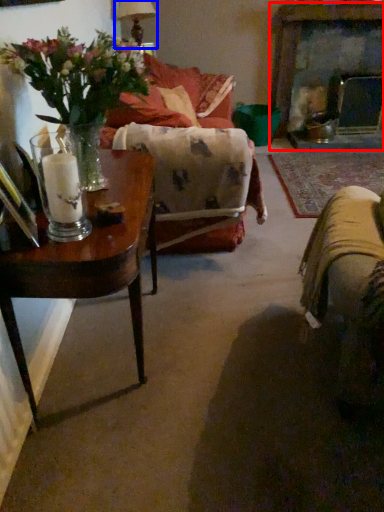
Question: Which point is closer to the camera, fireplace (highlighted by a red box) or lamp (highlighted by a blue box)?

Choices:
 (A) fireplace
 (B) lamp

Answer: (B)